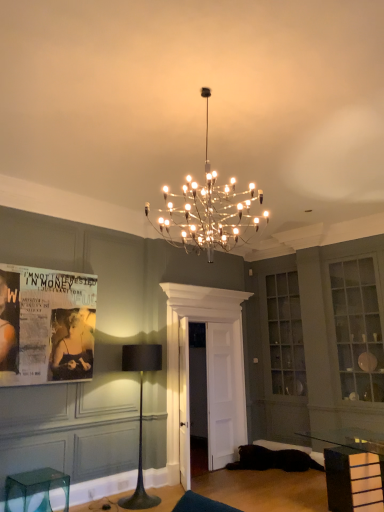
Question: From their relative heights in the image, would you say transparent plastic stool at lower left is taller or shorter than black fabric lamp at center?

Choices:
 (A) tall
 (B) short

Answer: (B)

Question: Is transparent plastic stool at lower left to the left or to the right of black fabric lamp at center in the image?

Choices:
 (A) right
 (B) left

Answer: (B)

Question: Considering the real-world distances, which object is closest to the transparent plastic stool at lower left?

Choices:
 (A) clear glass cabinet at upper right
 (B) matte paper poster at left
 (C) black fabric lamp at center
 (D) clear glass table at lower right

Answer: (B)

Question: Estimate the real-world distances between objects in this image. Which object is closer to the clear glass cabinet at upper right?

Choices:
 (A) clear glass table at lower right
 (B) black fabric lamp at center
 (C) matte paper poster at left
 (D) transparent plastic stool at lower left

Answer: (A)